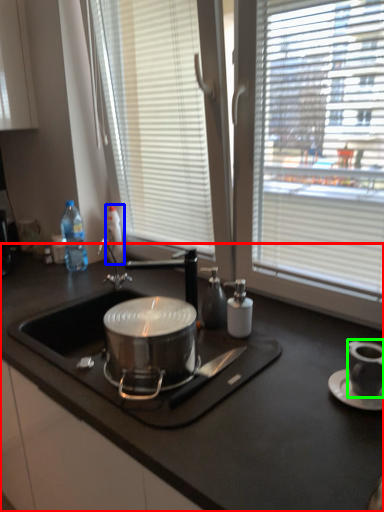
Question: Estimate the real-world distances between objects in this image. Which object is closer to countertop (highlighted by a red box), bottle (highlighted by a blue box) or appliance (highlighted by a green box)?

Choices:
 (A) bottle
 (B) appliance

Answer: (B)